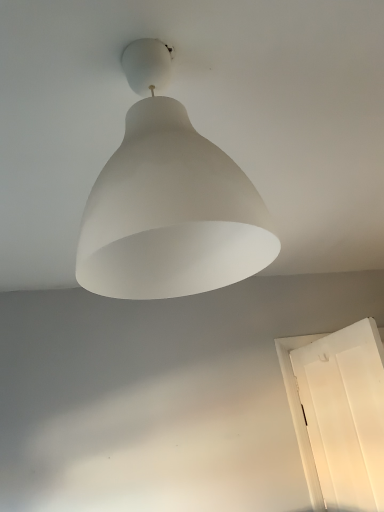
Question: From the image's perspective, is white matte door at lower right located above or below white matte lampshade at center?

Choices:
 (A) below
 (B) above

Answer: (A)

Question: Looking at their shapes, would you say white matte door at lower right is wider or thinner than white matte lampshade at center?

Choices:
 (A) wide
 (B) thin

Answer: (B)

Question: Would you say white matte door at lower right is to the left or to the right of white matte lampshade at center in the picture?

Choices:
 (A) right
 (B) left

Answer: (A)

Question: In the image, is white matte lampshade at center on the left side or the right side of white matte door at lower right?

Choices:
 (A) right
 (B) left

Answer: (B)

Question: Does point (157, 232) appear closer or farther from the camera than point (307, 485)?

Choices:
 (A) farther
 (B) closer

Answer: (B)

Question: Looking at their shapes, would you say white matte lampshade at center is wider or thinner than white matte door at lower right?

Choices:
 (A) thin
 (B) wide

Answer: (B)

Question: From a real-world perspective, is white matte lampshade at center above or below white matte door at lower right?

Choices:
 (A) below
 (B) above

Answer: (B)